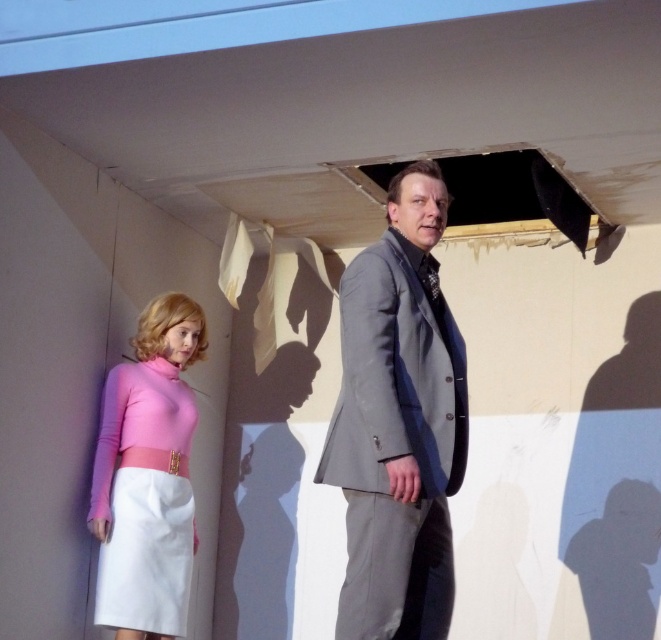
Consider the image. You are a delivery person who needs to place a 4.5 feet long package between the gray wool suit at center and the pink matte fabric dress at lower left. Is there enough space to fit the package without moving either object?

The distance between the gray wool suit at center and the pink matte fabric dress at lower left is 4.15 feet. Since the package is 4.5 feet long, it is longer than the available space. Therefore, the package cannot be placed between them without moving either object.